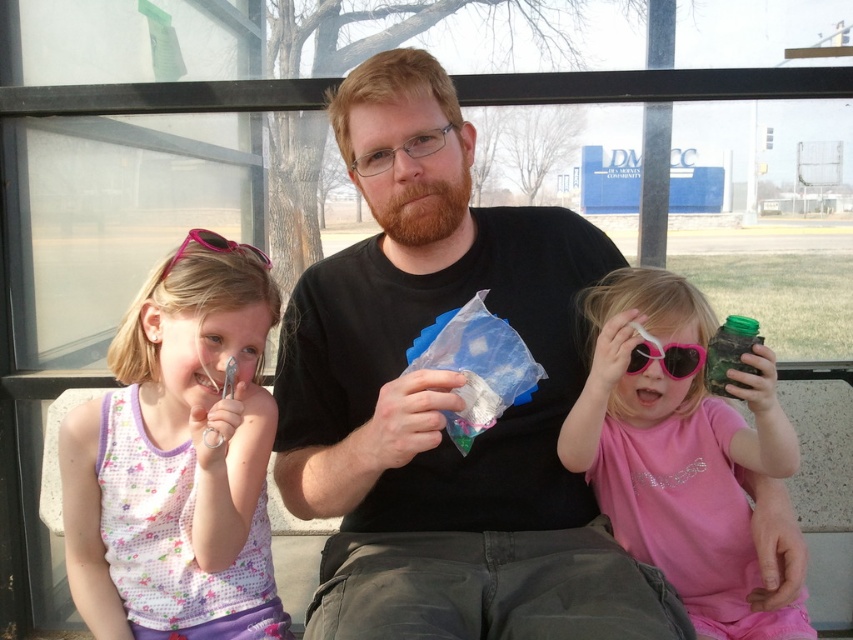
Question: Which object is the farthest from the black matte shirt at center?

Choices:
 (A) pink plastic goggles at upper left
 (B) pink plastic goggles at center
 (C) pink fabric dress at left

Answer: (A)

Question: Does black matte shirt at center appear on the left side of pink fabric dress at left?

Choices:
 (A) no
 (B) yes

Answer: (A)

Question: Is black matte shirt at center positioned in front of pink plastic goggles at upper left?

Choices:
 (A) yes
 (B) no

Answer: (A)

Question: Which of these objects is positioned closest to the pink fabric dress at left?

Choices:
 (A) pink glossy sunglasses at center
 (B) black matte shirt at center
 (C) pink plastic goggles at center
 (D) pink plastic goggles at upper left

Answer: (B)

Question: From the image, what is the correct spatial relationship of pink plastic goggles at center in relation to pink plastic goggles at upper left?

Choices:
 (A) left
 (B) right

Answer: (B)

Question: Which object is farther from the camera taking this photo?

Choices:
 (A) pink glossy sunglasses at center
 (B) pink fabric dress at left
 (C) black matte shirt at center

Answer: (B)